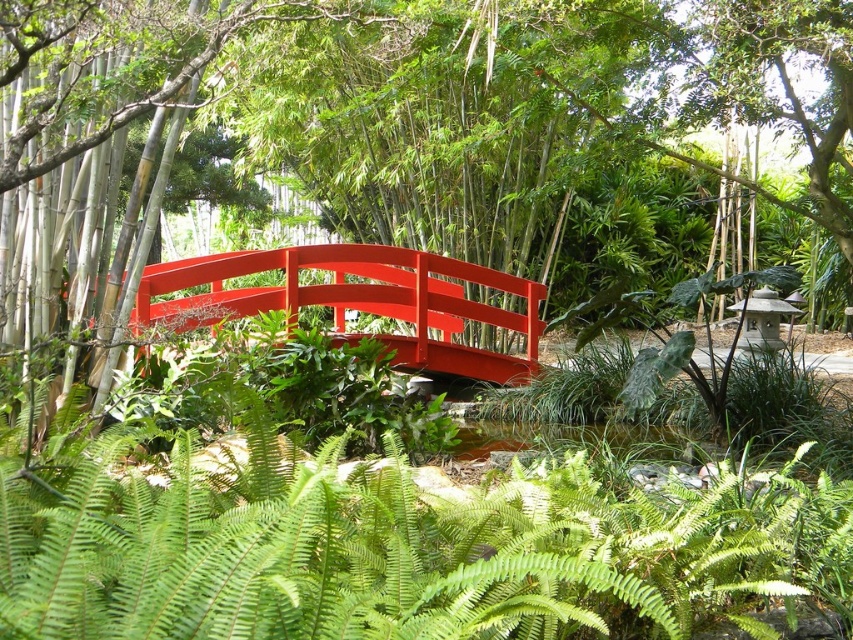
Question: Is green leafy tree at center further to the viewer compared to glossy wood bridge at center?

Choices:
 (A) yes
 (B) no

Answer: (B)

Question: Which of the following is the farthest from the observer?

Choices:
 (A) green leafy tree at center
 (B) glossy wood bridge at center

Answer: (B)

Question: Among these points, which one is nearest to the camera?

Choices:
 (A) (527, 356)
 (B) (459, 97)

Answer: (A)

Question: Is green leafy tree at center thinner than glossy wood bridge at center?

Choices:
 (A) yes
 (B) no

Answer: (B)

Question: Considering the relative positions of green leafy tree at center and glossy wood bridge at center in the image provided, where is green leafy tree at center located with respect to glossy wood bridge at center?

Choices:
 (A) above
 (B) below

Answer: (A)